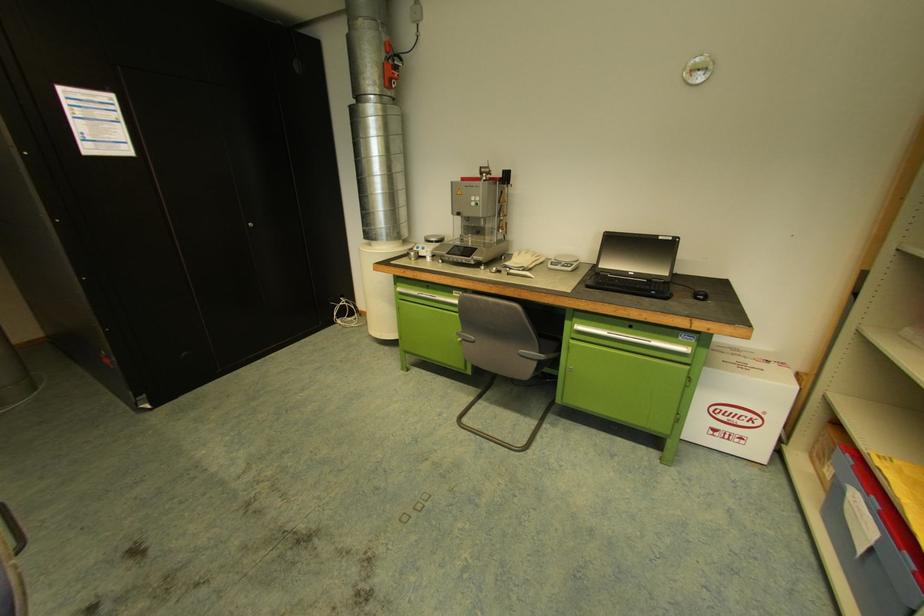
At what (x,y) coordinates should I click in order to perform the action: click on chair sitting surface. Please return your answer as a coordinate pair (x, y). Image resolution: width=924 pixels, height=616 pixels. Looking at the image, I should click on (539, 346).